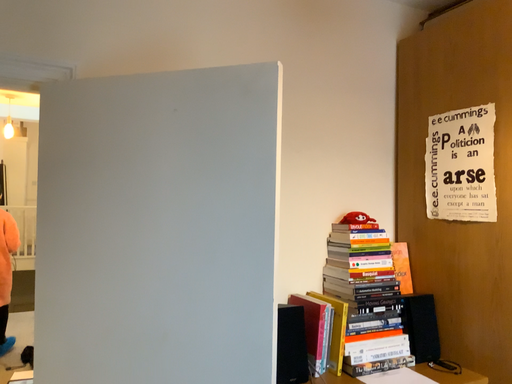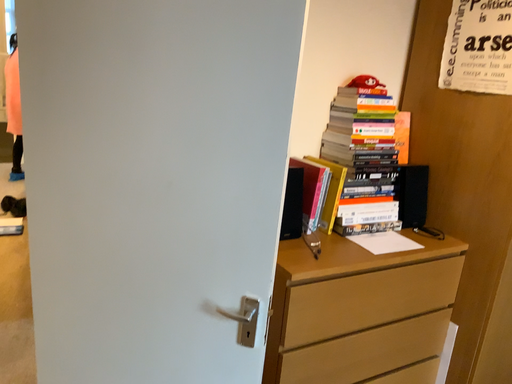
Question: How did the camera likely rotate when shooting the video?

Choices:
 (A) rotated downward
 (B) rotated upward

Answer: (A)